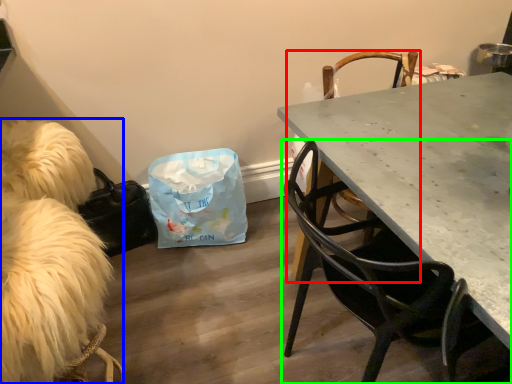
Question: Estimate the real-world distances between objects in this image. Which object is farther from chair (highlighted by a red box), animal (highlighted by a blue box) or chair (highlighted by a green box)?

Choices:
 (A) animal
 (B) chair

Answer: (A)